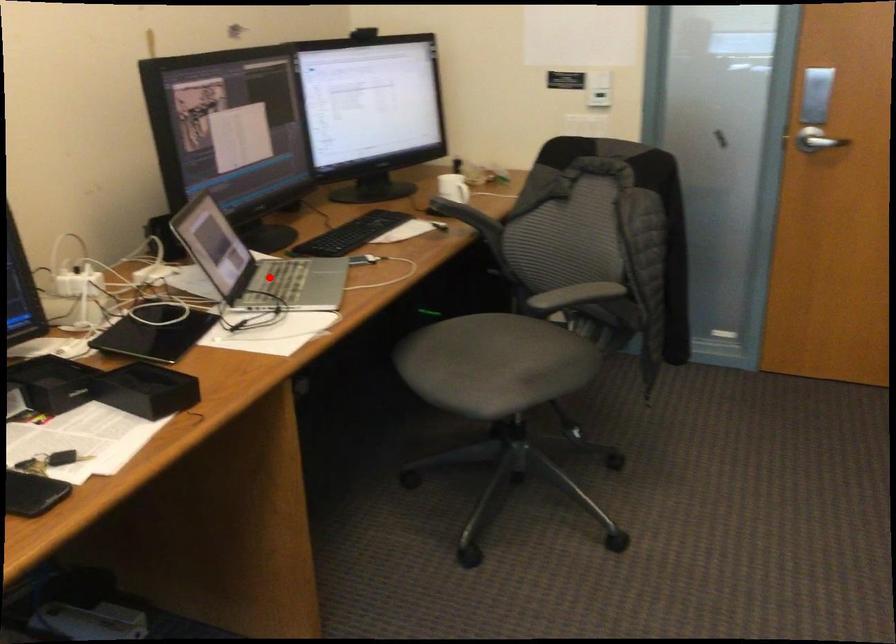
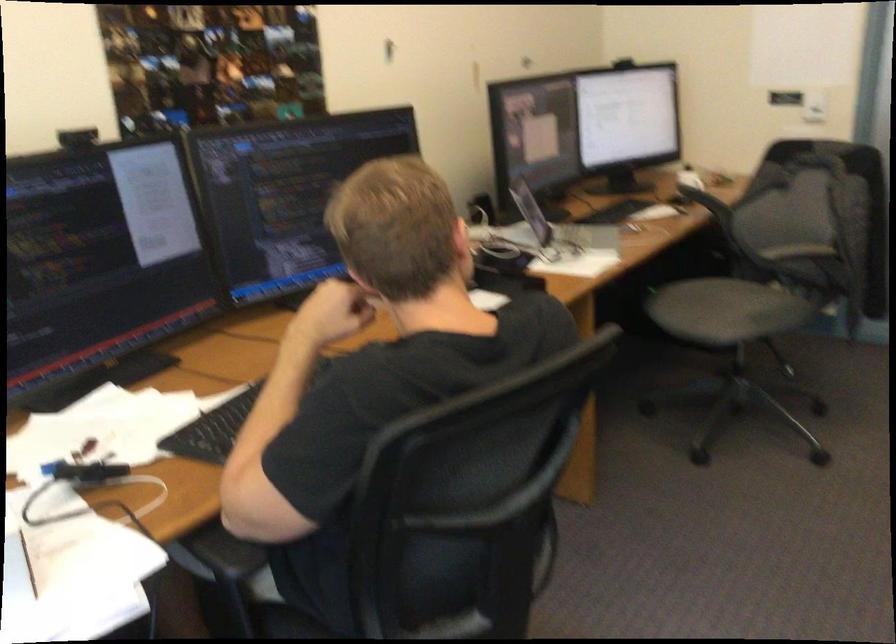
Question: I am providing you with two images of the same scene from different viewpoints. A red point is shown in image1. For the corresponding object point in image2, is it positioned nearer or farther from the camera?

Choices:
 (A) Nearer
 (B) Farther

Answer: (B)